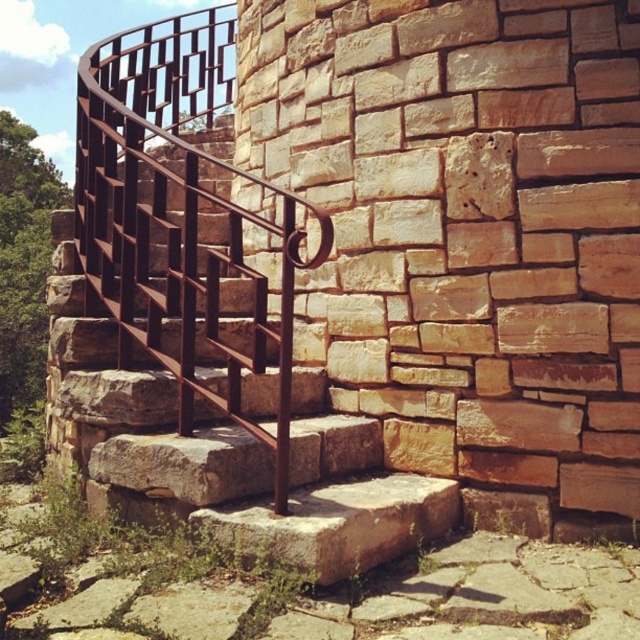
Question: Which of the following is the farthest from the observer?

Choices:
 (A) rusty metal railing at center
 (B) rusty metal stairwell at center

Answer: (B)

Question: Which point is farther to the camera?

Choices:
 (A) rusty metal railing at center
 (B) rusty metal stairwell at center

Answer: (B)

Question: Is rusty metal stairwell at center positioned at the back of rusty metal railing at center?

Choices:
 (A) yes
 (B) no

Answer: (A)

Question: Among these points, which one is nearest to the camera?

Choices:
 (A) (93, 220)
 (B) (56, 378)

Answer: (A)

Question: Is rusty metal stairwell at center positioned before rusty metal railing at center?

Choices:
 (A) yes
 (B) no

Answer: (B)

Question: Does rusty metal stairwell at center appear under rusty metal railing at center?

Choices:
 (A) yes
 (B) no

Answer: (A)